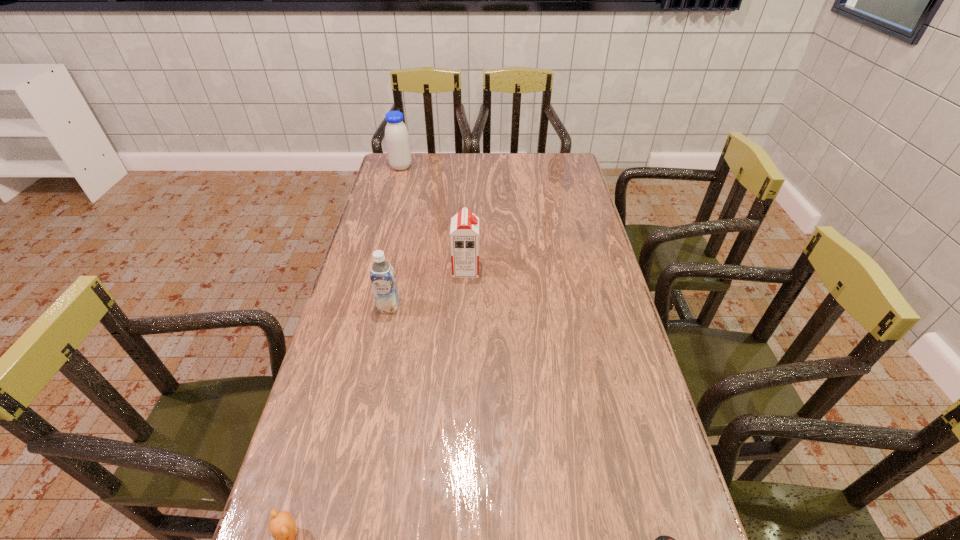
This screenshot has height=540, width=960. In order to click on the farthest soya milk in this screenshot , I will do `click(397, 140)`.

Identify the location of the second object from right to left. This screenshot has width=960, height=540. (464, 233).

Where is `the rightmost soya milk`? the rightmost soya milk is located at coordinates (464, 233).

Locate an element on the screen. the third farthest object is located at coordinates (382, 275).

You are a GUI agent. You are given a task and a screenshot of the screen. Output one action in this format:
    pyautogui.click(x=<x>, y=<y>)
    Task: Click on the vacant region located 0.110m on the right of the farthest soya milk
    
    Given the screenshot: What is the action you would take?
    pyautogui.click(x=438, y=167)

Where is `vacant region located 0.090m on the left of the rightmost soya milk`? vacant region located 0.090m on the left of the rightmost soya milk is located at coordinates (425, 269).

Locate an element on the screen. free space located 0.300m on the label of the third farthest object is located at coordinates (368, 407).

Where is `object that is at the far edge`? The width and height of the screenshot is (960, 540). object that is at the far edge is located at coordinates (397, 140).

I want to click on object situated at the far left corner, so [x=397, y=140].

Image resolution: width=960 pixels, height=540 pixels. I want to click on vacant space at the far edge of the desktop, so click(460, 165).